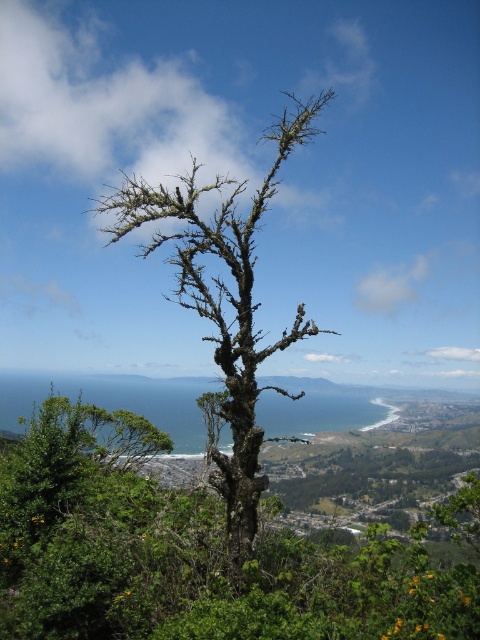
You are standing at the viewpoint and see the green mossy tree at center and the dark brown bark tree at center. Which tree is closer to you?

The green mossy tree at center is closer to you because it is positioned in front of the dark brown bark tree at center.

You are standing at the center of the image and want to walk towards the green mossy tree at center. Which direction should you move in relation to your current position?

The green mossy tree at center is located at point 0.873 on the x and 0.400 on the y coordinates. Since you are already at the center, you should move towards the right and slightly downward to reach the tree.

You are standing at the vantage point overlooking the coastal landscape. You want to take a photo of the green mossy tree at center. If your camera can focus on objects up to 20 feet away, will it be able to capture the tree clearly?

The green mossy tree at center is 18.86 feet away from the camera, which is within the 20 feet focusing range. Therefore, the camera can capture the tree clearly.